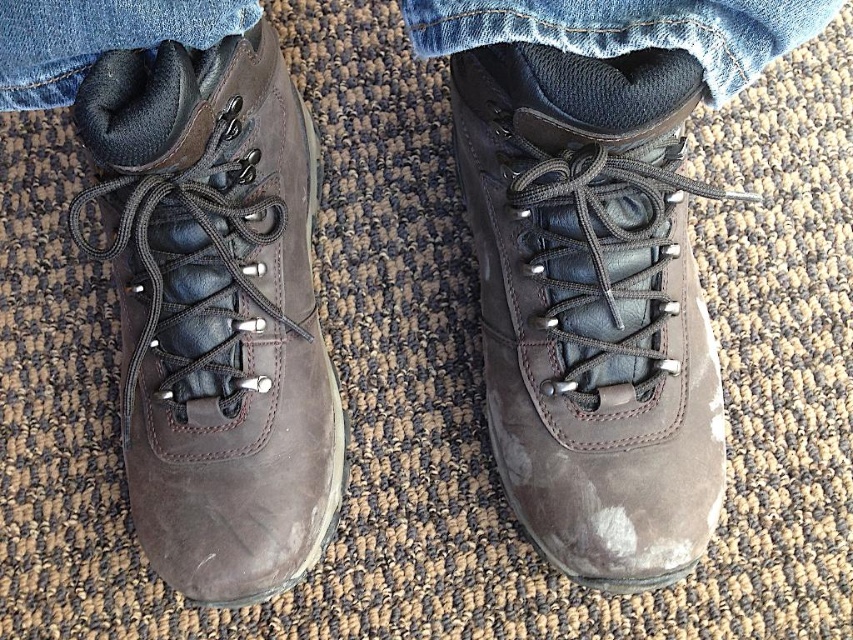
Question: Considering the real-world distances, which object is closest to the denim at left?

Choices:
 (A) denim at center
 (B) brown suede boot at left

Answer: (A)

Question: Which point is farther from the camera taking this photo?

Choices:
 (A) (476, 36)
 (B) (491, 364)
 (C) (56, 88)

Answer: (B)

Question: Observing the image, what is the correct spatial positioning of brown suede boot at center in reference to denim at left?

Choices:
 (A) left
 (B) right

Answer: (B)

Question: Does brown suede boot at center appear under brown suede boot at left?

Choices:
 (A) yes
 (B) no

Answer: (B)

Question: Which point is closer to the camera?

Choices:
 (A) brown suede boot at center
 (B) denim at center
 (C) brown suede boot at left
 (D) denim at left

Answer: (D)

Question: Does brown suede boot at left appear under denim at center?

Choices:
 (A) no
 (B) yes

Answer: (B)